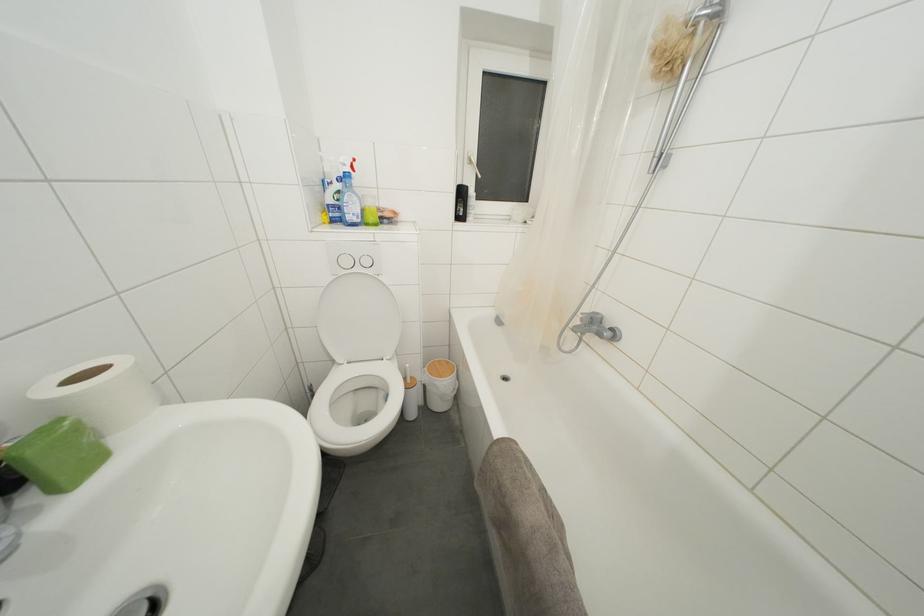
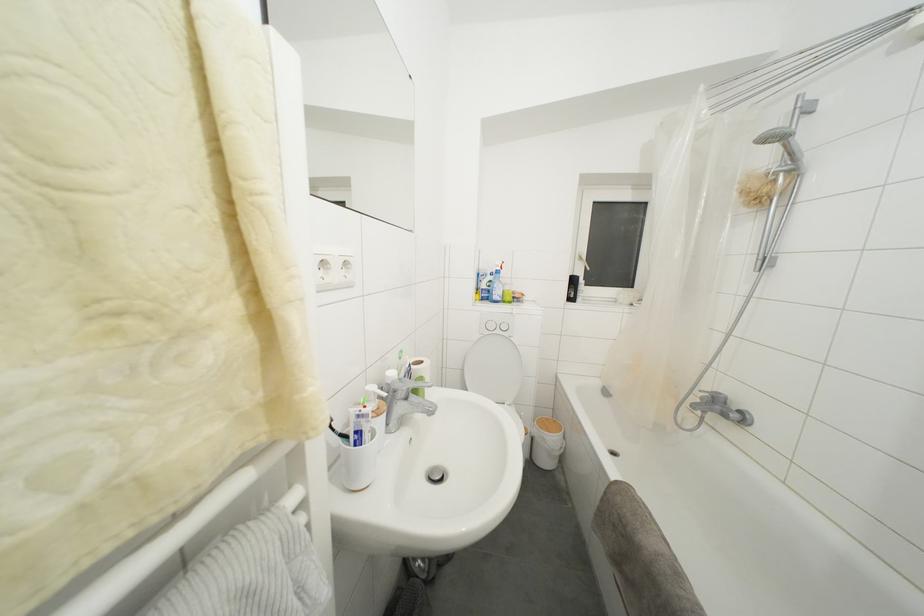
Locate, in the second image, the point that corresponds to pixel 432 392 in the first image.

(541, 445)